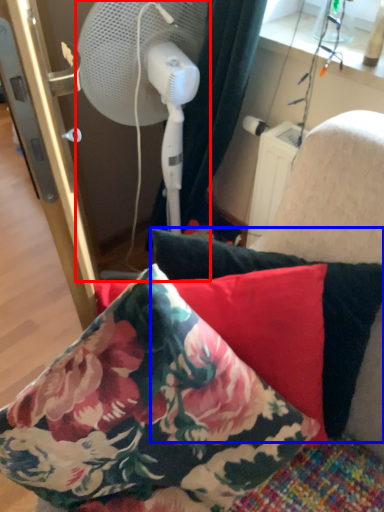
Question: Which of the following is the farthest to the observer, mechanical fan (highlighted by a red box) or pillow (highlighted by a blue box)?

Choices:
 (A) mechanical fan
 (B) pillow

Answer: (A)